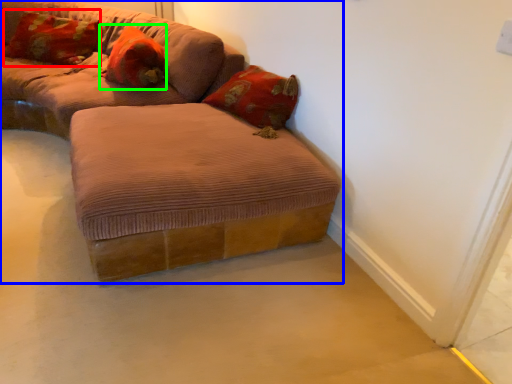
Question: Which object is the farthest from pillow (highlighted by a red box)? Choose among these: studio couch (highlighted by a blue box) or pillow (highlighted by a green box).

Choices:
 (A) studio couch
 (B) pillow

Answer: (A)